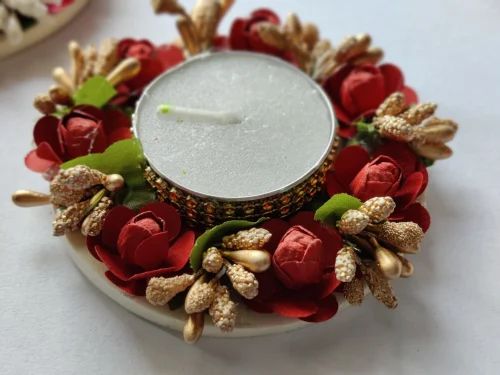
Where is `fake roses`? fake roses is located at coordinates (208, 237), (306, 247), (383, 172), (371, 78), (244, 35), (150, 57), (75, 131), (139, 231).